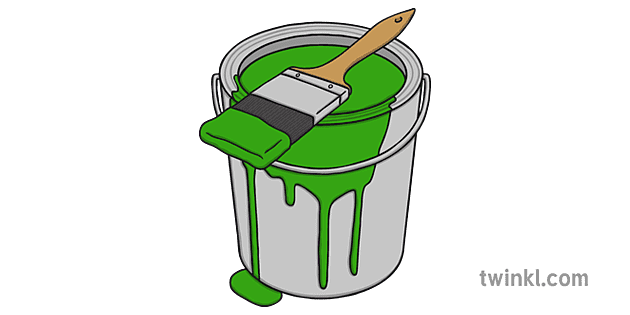
The width and height of the screenshot is (630, 315). Identify the location of green paint. (365, 79), (244, 135), (333, 154), (247, 285).